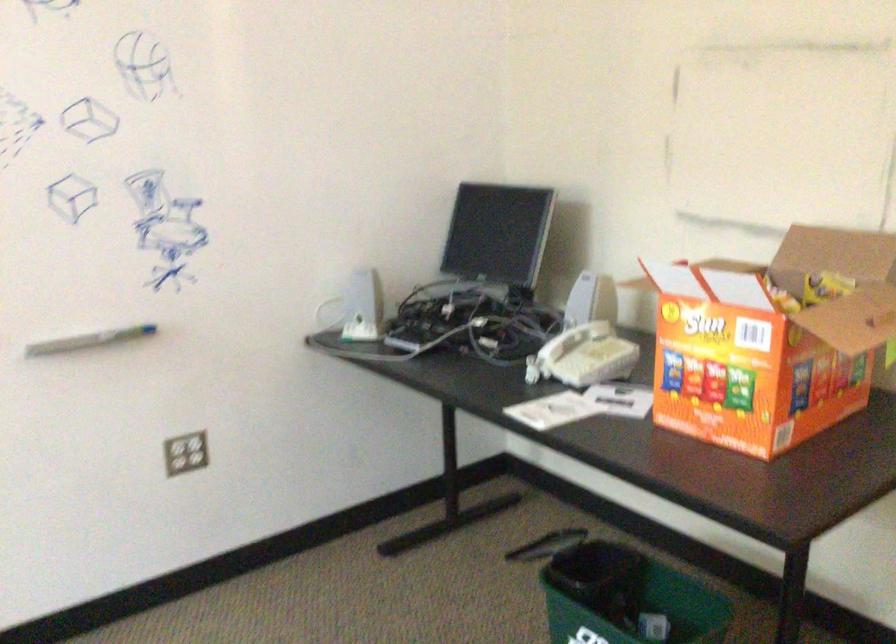
The image size is (896, 644). What do you see at coordinates (185, 453) in the screenshot?
I see `the power outlet socket` at bounding box center [185, 453].